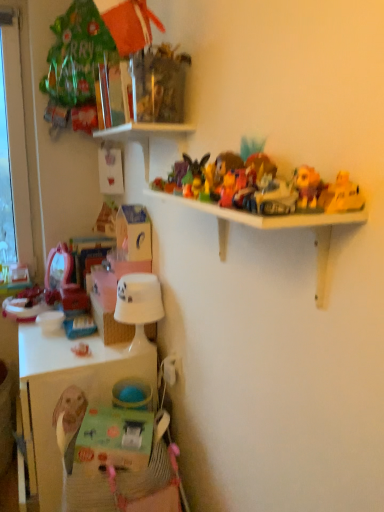
Locate an element on the screen. vacant space underneath white glossy lampshade at lower center (from a real-world perspective) is located at coordinates (139, 352).